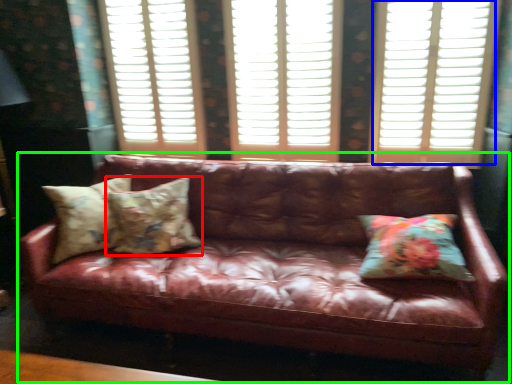
Question: Which is nearer to the pillow (highlighted by a red box)? window (highlighted by a blue box) or studio couch (highlighted by a green box).

Choices:
 (A) window
 (B) studio couch

Answer: (B)